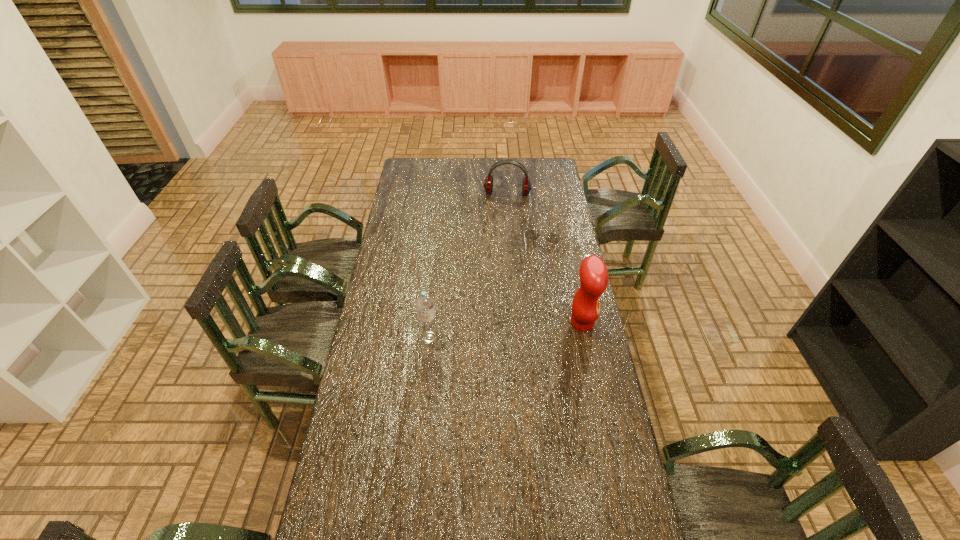
Locate an element on the screen. Image resolution: width=960 pixels, height=540 pixels. free space between the second shortest object and the shortest object is located at coordinates (525, 222).

Locate an element on the screen. vacant area that lies between the shortest object and the farthest object is located at coordinates (525, 222).

This screenshot has height=540, width=960. I want to click on vacant space that's between the shortest object and the tallest object, so click(x=563, y=286).

You are a GUI agent. You are given a task and a screenshot of the screen. Output one action in this format:
    pyautogui.click(x=<x>, y=<y>)
    Task: Click on the object that stands as the third closest to the tallest object
    This screenshot has width=960, height=540.
    Given the screenshot: What is the action you would take?
    pos(488,183)

Where is `the second closest object relative to the shortest object`? The width and height of the screenshot is (960, 540). the second closest object relative to the shortest object is located at coordinates (488, 183).

You are a GUI agent. You are given a task and a screenshot of the screen. Output one action in this format:
    pyautogui.click(x=<x>, y=<y>)
    Task: Click on the free location that satisfies the following two spatial constraints: 1. on the front side of the spectacles; 2. on the label side of the condiment
    
    Given the screenshot: What is the action you would take?
    pyautogui.click(x=554, y=323)

This screenshot has height=540, width=960. I want to click on free space that satisfies the following two spatial constraints: 1. on the front side of the tallest object; 2. on the label side of the earphone, so click(516, 323).

Locate an element on the screen. The width and height of the screenshot is (960, 540). vacant space that satisfies the following two spatial constraints: 1. on the back side of the condiment; 2. on the label side of the second tallest object is located at coordinates (431, 323).